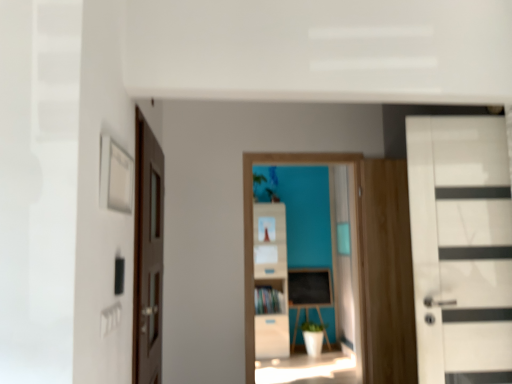
This screenshot has height=384, width=512. In order to click on empty space that is ontop of white glossy door at right, the second door when ordered from left to right (from a real-world perspective) in this screenshot , I will do `click(462, 115)`.